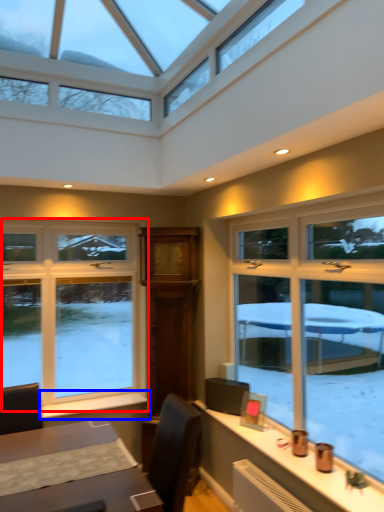
Question: Which of the following is the closest to the observer, window (highlighted by a red box) or window sill (highlighted by a blue box)?

Choices:
 (A) window
 (B) window sill

Answer: (B)